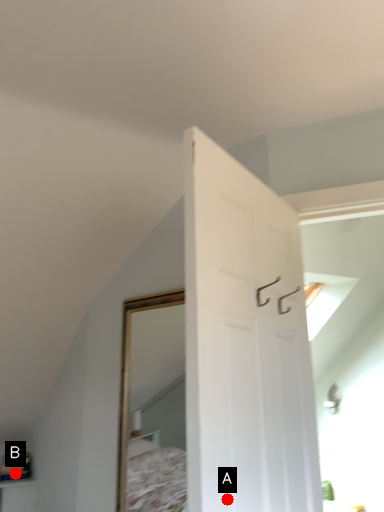
Question: Two points are circled on the image, labeled by A and B beside each circle. Which point is farther to the camera?

Choices:
 (A) A is further
 (B) B is further

Answer: (B)